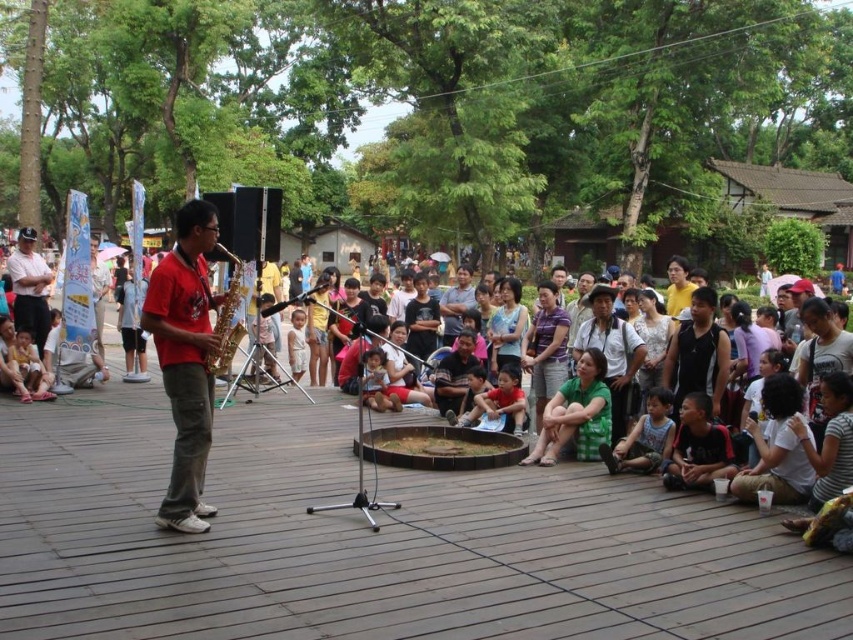
Question: Among these objects, which one is farthest from the camera?

Choices:
 (A) gold metallic saxophone at center
 (B) matte green clothing at center

Answer: (B)

Question: Is matte green clothing at center above red matte saxophone at left?

Choices:
 (A) yes
 (B) no

Answer: (A)

Question: Estimate the real-world distances between objects in this image. Which object is farther from the matte green clothing at center?

Choices:
 (A) red matte saxophone at left
 (B) matte black shirt at upper left
 (C) gold metallic saxophone at center

Answer: (B)

Question: Can you confirm if matte green clothing at center is wider than matte black shirt at upper left?

Choices:
 (A) yes
 (B) no

Answer: (A)

Question: Does matte green clothing at center have a lesser width compared to red matte saxophone at left?

Choices:
 (A) yes
 (B) no

Answer: (B)

Question: Which object appears farthest from the camera in this image?

Choices:
 (A) matte green clothing at center
 (B) red matte saxophone at left
 (C) gold metallic saxophone at center

Answer: (A)